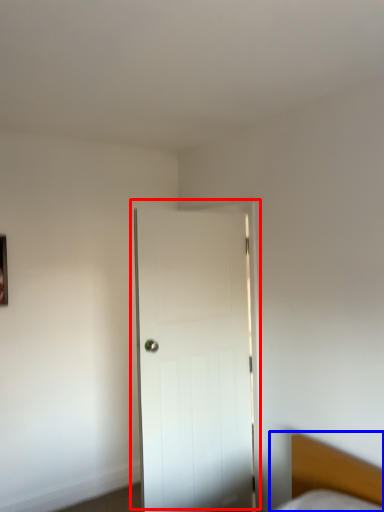
Question: Which of the following is the closest to the observer, door (highlighted by a red box) or bed (highlighted by a blue box)?

Choices:
 (A) door
 (B) bed

Answer: (B)